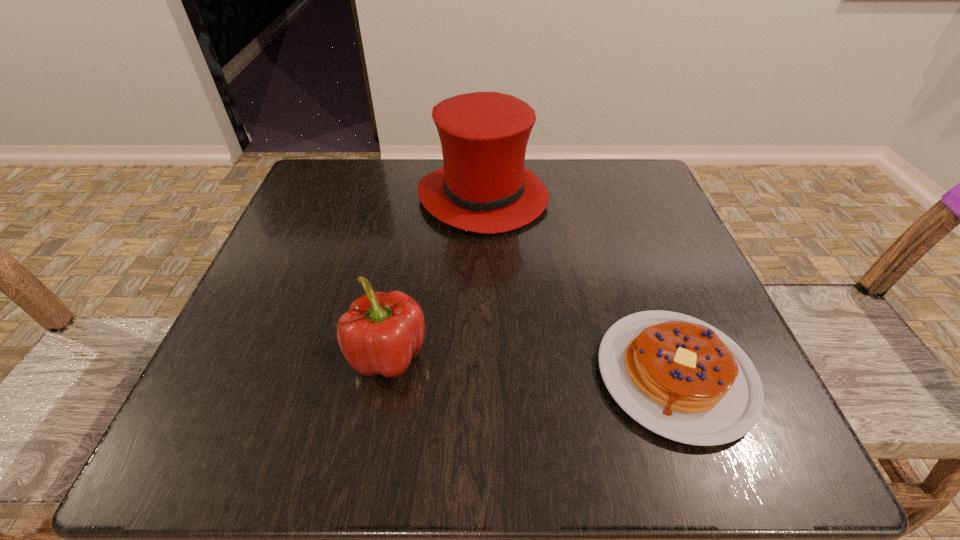
At what (x,y) coordinates should I click in order to perform the action: click on free space that is in between the hat and the rightmost object. Please return your answer as a coordinate pair (x, y). The height and width of the screenshot is (540, 960). Looking at the image, I should click on (579, 286).

Image resolution: width=960 pixels, height=540 pixels. Find the location of `vacant space in between the pepper and the shortest object`. vacant space in between the pepper and the shortest object is located at coordinates (532, 365).

This screenshot has height=540, width=960. What are the coordinates of `vacant space that's between the pancake and the hat` in the screenshot? It's located at (579, 286).

Locate an element on the screen. The image size is (960, 540). empty location between the second tallest object and the rightmost object is located at coordinates (532, 365).

Where is `free space between the pepper and the pancake`? free space between the pepper and the pancake is located at coordinates (532, 365).

At what (x,y) coordinates should I click in order to perform the action: click on free space between the shortest object and the pepper. Please return your answer as a coordinate pair (x, y). Looking at the image, I should click on (532, 365).

Locate an element on the screen. This screenshot has height=540, width=960. blank region between the pancake and the pepper is located at coordinates (532, 365).

You are a GUI agent. You are given a task and a screenshot of the screen. Output one action in this format:
    pyautogui.click(x=<x>, y=<y>)
    Task: Click on the free spot between the second shortest object and the farthest object
    This screenshot has width=960, height=540.
    Given the screenshot: What is the action you would take?
    pyautogui.click(x=435, y=276)

The width and height of the screenshot is (960, 540). What are the coordinates of `free space that is in between the pepper and the tallest object` in the screenshot? It's located at (435, 276).

Identify which object is the closest to the second shortest object. Please provide its 2D coordinates. Your answer should be formatted as a tuple, i.e. [(x, y)], where the tuple contains the x and y coordinates of a point satisfying the conditions above.

[(483, 187)]